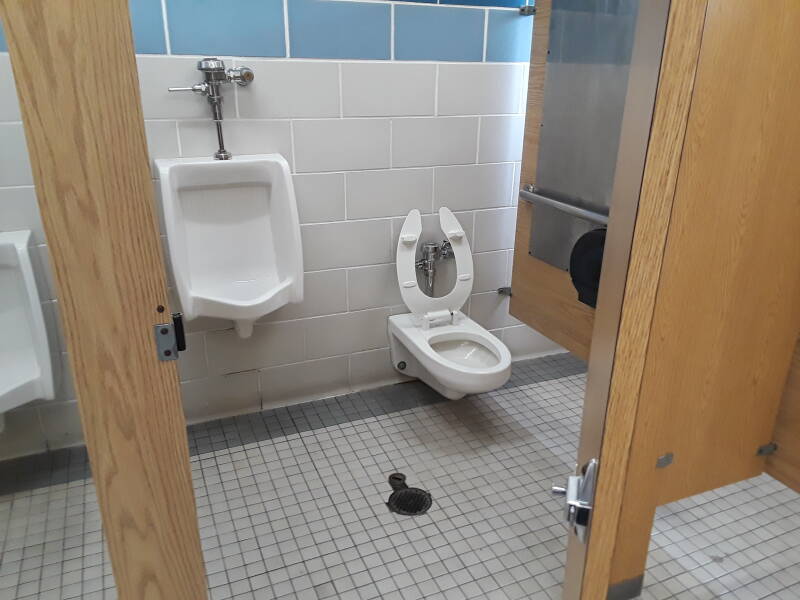
Where is `door`? door is located at coordinates (644, 216).